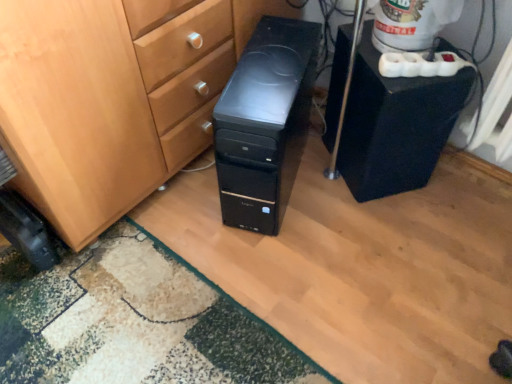
Image resolution: width=512 pixels, height=384 pixels. Find the location of `free space in front of black rubber wheel at lower left`. free space in front of black rubber wheel at lower left is located at coordinates (33, 304).